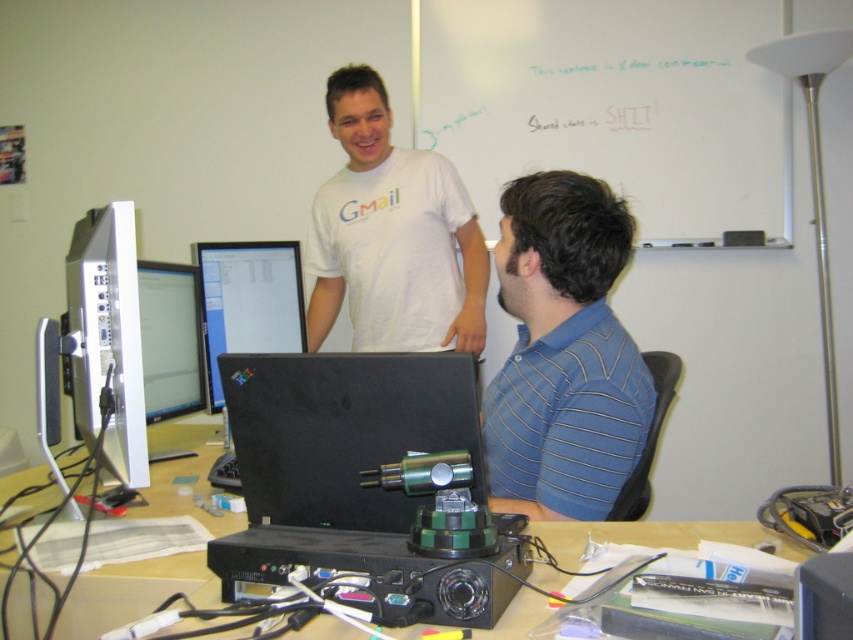
Question: Which is nearer to the white glossy monitor at left?

Choices:
 (A) whiteboard at upper center
 (B) matte black monitor at left

Answer: (B)

Question: Can you confirm if whiteboard at upper center is positioned above blue striped shirt at right?

Choices:
 (A) no
 (B) yes

Answer: (B)

Question: Which of the following is the closest to the observer?

Choices:
 (A) (616, 340)
 (B) (521, 141)
 (C) (131, 227)
 (D) (212, 371)

Answer: (C)

Question: In this image, where is black matte laptop at center located relative to white glossy monitor at left?

Choices:
 (A) above
 (B) below

Answer: (B)

Question: Which point appears farthest from the camera in this image?

Choices:
 (A) (135, 384)
 (B) (178, 381)
 (C) (47, 589)

Answer: (B)

Question: From the image, what is the correct spatial relationship of white glossy gmail t-shirt at upper center in relation to white glossy monitor at left?

Choices:
 (A) left
 (B) right

Answer: (B)